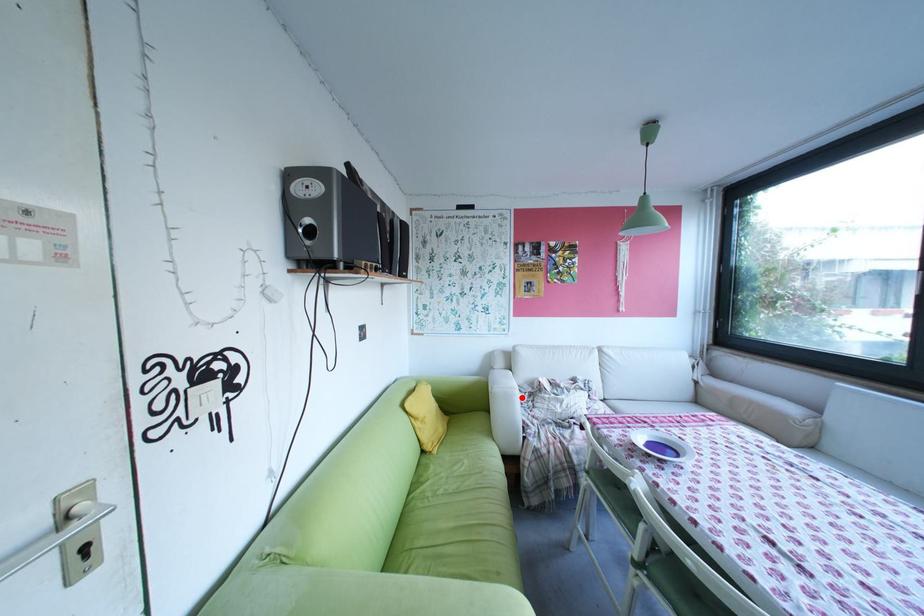
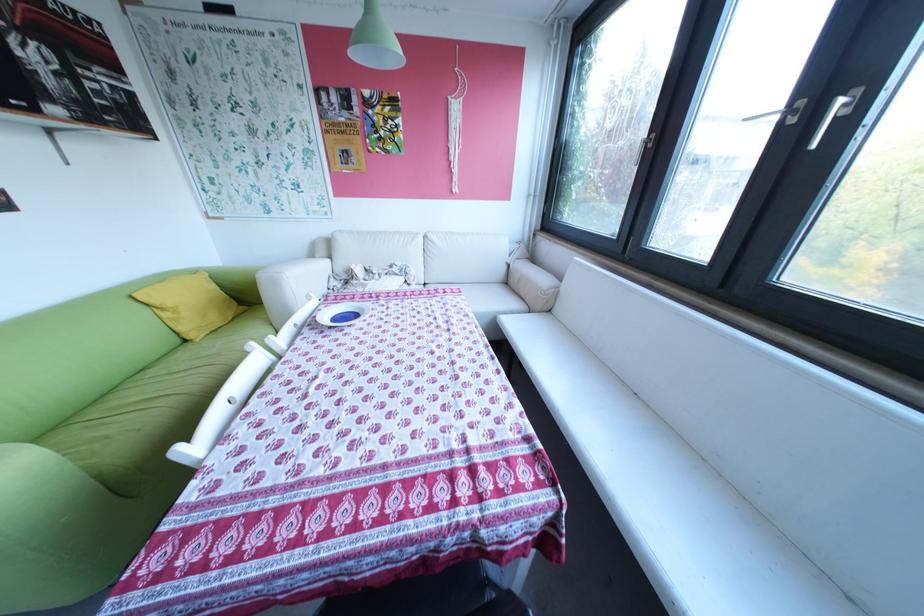
Question: I am providing you with two images of the same scene from different viewpoints. A red point is shown in image1. For the corresponding object point in image2, is it positioned nearer or farther from the camera?

Choices:
 (A) Nearer
 (B) Farther

Answer: (A)